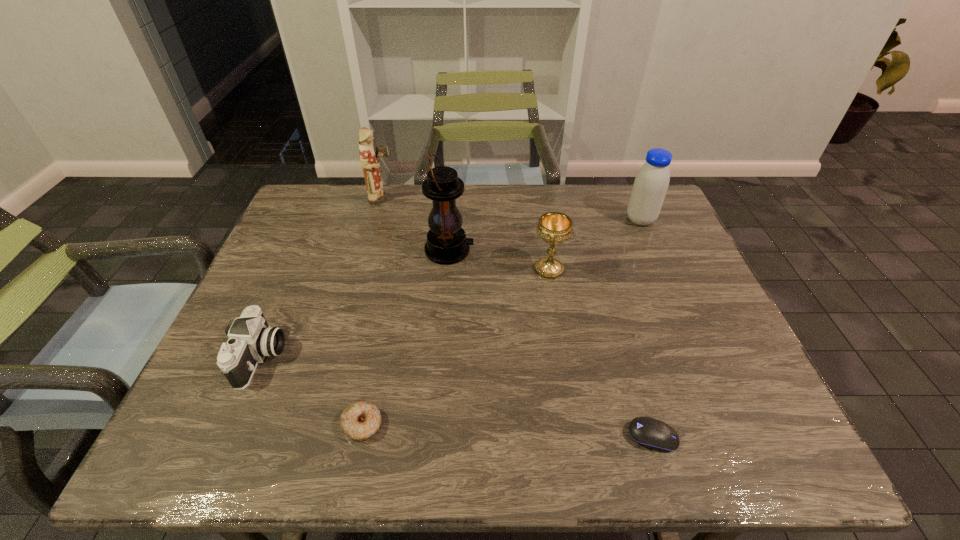
Where is `vacant space at the near left corner of the desktop`? The width and height of the screenshot is (960, 540). vacant space at the near left corner of the desktop is located at coordinates (205, 463).

The width and height of the screenshot is (960, 540). What are the coordinates of `unoccupied position between the second farthest object and the fifth farthest object` in the screenshot? It's located at (451, 289).

Where is `free space between the computer mouse and the tallest object`? This screenshot has width=960, height=540. free space between the computer mouse and the tallest object is located at coordinates (551, 343).

Locate an element on the screen. free space between the sixth object from right to left and the second object from right to left is located at coordinates (517, 318).

Where is `vacant area between the third nearest object and the fourth shortest object`? The height and width of the screenshot is (540, 960). vacant area between the third nearest object and the fourth shortest object is located at coordinates (405, 313).

Image resolution: width=960 pixels, height=540 pixels. Identify the location of empty space that is in between the sixth object from right to left and the computer mouse. (517, 318).

Where is `vacant space that is in between the sixth object from left to right and the lantern`? Image resolution: width=960 pixels, height=540 pixels. vacant space that is in between the sixth object from left to right and the lantern is located at coordinates (551, 343).

Image resolution: width=960 pixels, height=540 pixels. In order to click on free spot between the computer mouse and the third shortest object in this screenshot , I will do `click(457, 397)`.

The image size is (960, 540). In order to click on free space that is in between the sixth object from right to left and the fourth object from left to right in this screenshot , I will do `click(416, 225)`.

At what (x,y) coordinates should I click in order to perform the action: click on vacant region between the figurine and the doughnut. Please return your answer as a coordinate pair (x, y). The height and width of the screenshot is (540, 960). Looking at the image, I should click on (372, 312).